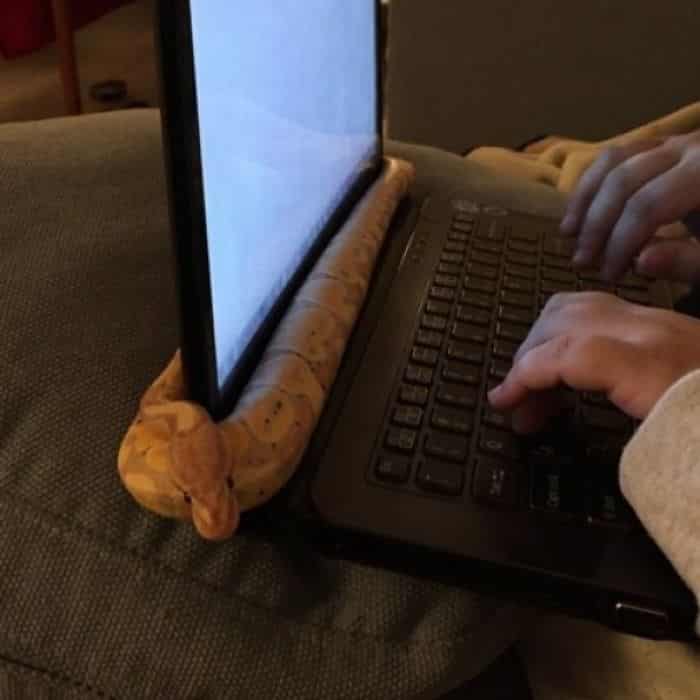
Identify the location of pillow. (131, 236).